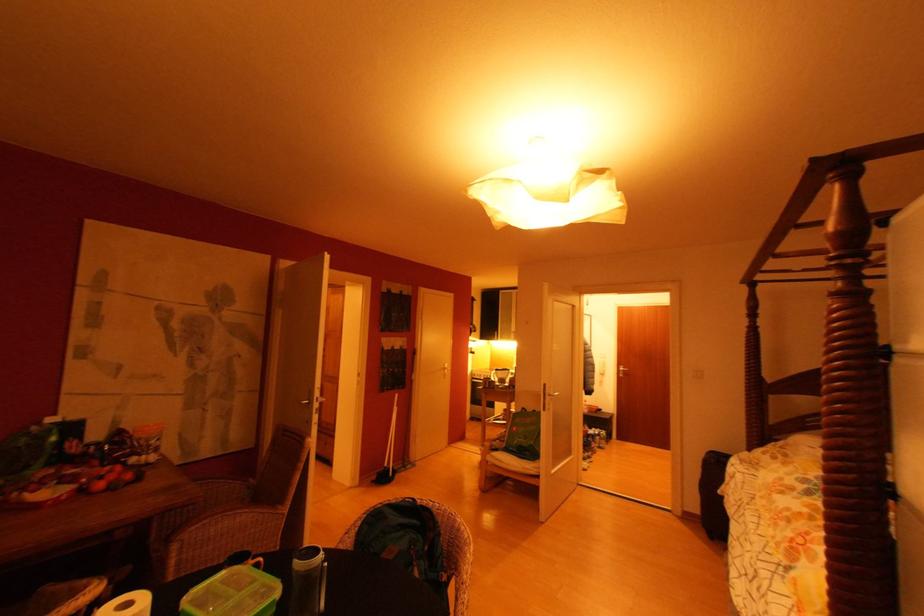
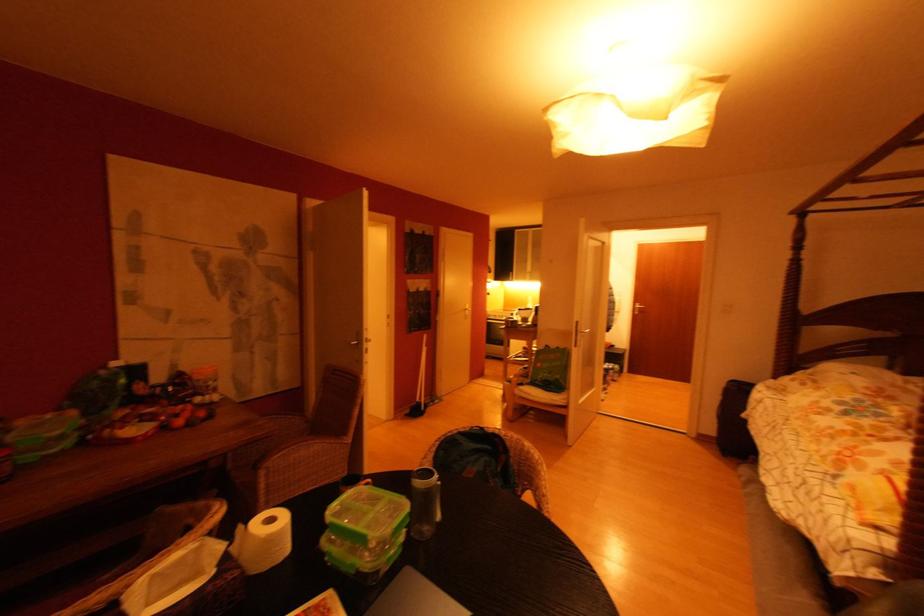
Question: The first image is from the beginning of the video and the second image is from the end. How did the camera likely rotate when shooting the video?

Choices:
 (A) Left
 (B) Right
 (C) Up
 (D) Down

Answer: (D)